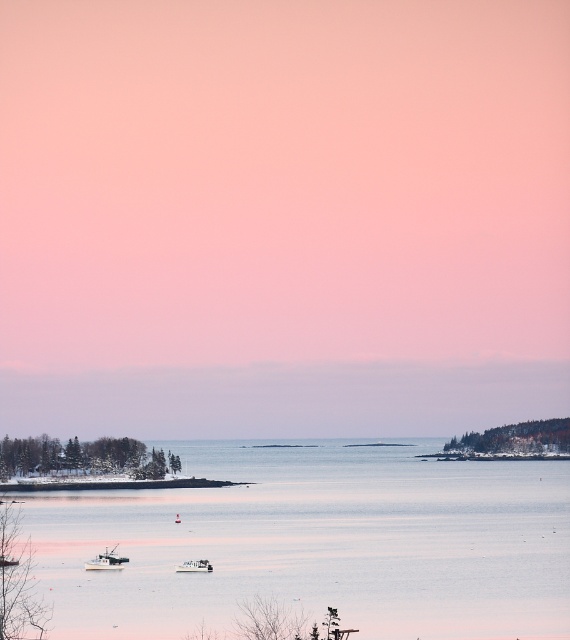
Question: Does clear water at center have a lesser width compared to white matte boat at lower center?

Choices:
 (A) yes
 (B) no

Answer: (B)

Question: Can you confirm if clear water at center is positioned to the left of white matte boat at lower center?

Choices:
 (A) no
 (B) yes

Answer: (A)

Question: Is clear water at center to the right of white matte boat at lower center from the viewer's perspective?

Choices:
 (A) yes
 (B) no

Answer: (A)

Question: Among these points, which one is nearest to the camera?

Choices:
 (A) (296, 605)
 (B) (182, 566)
 (C) (92, 563)

Answer: (A)

Question: Which object appears farthest from the camera in this image?

Choices:
 (A) white matte boat at center
 (B) clear water at center

Answer: (A)

Question: Which point appears closest to the camera in this image?

Choices:
 (A) (99, 561)
 (B) (408, 465)
 (C) (205, 566)

Answer: (C)